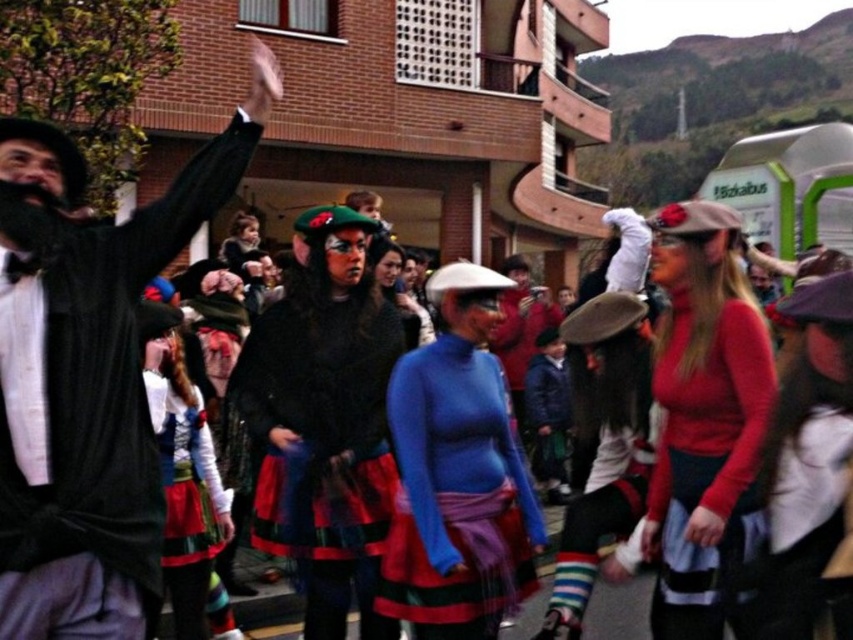
Does matte black coat at left appear under velvet black dress at center?

No.

Is matte black coat at left taller than velvet black dress at center?

Indeed, matte black coat at left has a greater height compared to velvet black dress at center.

Does point (21, 248) come farther from viewer compared to point (381, 536)?

No, (21, 248) is in front of (381, 536).

At what (x,y) coordinates should I click in order to perform the action: click on matte black coat at left. Please return your answer as a coordinate pair (x, y). The height and width of the screenshot is (640, 853). Looking at the image, I should click on (88, 376).

Is velvet black dress at center further to camera compared to red matte sweater at center?

Yes, it is behind red matte sweater at center.

Identify the location of velvet black dress at center. (323, 445).

Is blue turtleneck sweater at center taller than red matte sweater at center?

No, blue turtleneck sweater at center is not taller than red matte sweater at center.

Who is higher up, blue turtleneck sweater at center or red matte sweater at center?

red matte sweater at center is higher up.

Where is `blue turtleneck sweater at center`? The width and height of the screenshot is (853, 640). blue turtleneck sweater at center is located at coordinates (456, 493).